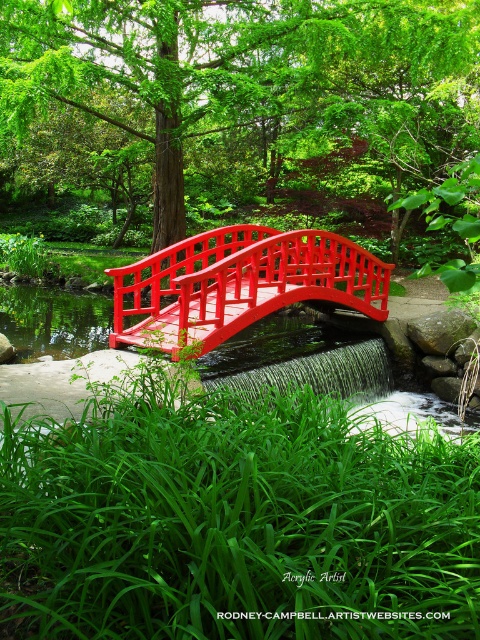
Is point (124, 637) positioned after point (298, 273)?

No, it is in front of (298, 273).

Locate an element on the screen. The width and height of the screenshot is (480, 640). glossy wooden bridge at center is located at coordinates (232, 522).

Is point (451, 508) behind point (202, 349)?

No.

Image resolution: width=480 pixels, height=640 pixels. In order to click on glossy wooden bridge at center in this screenshot , I will do `click(232, 522)`.